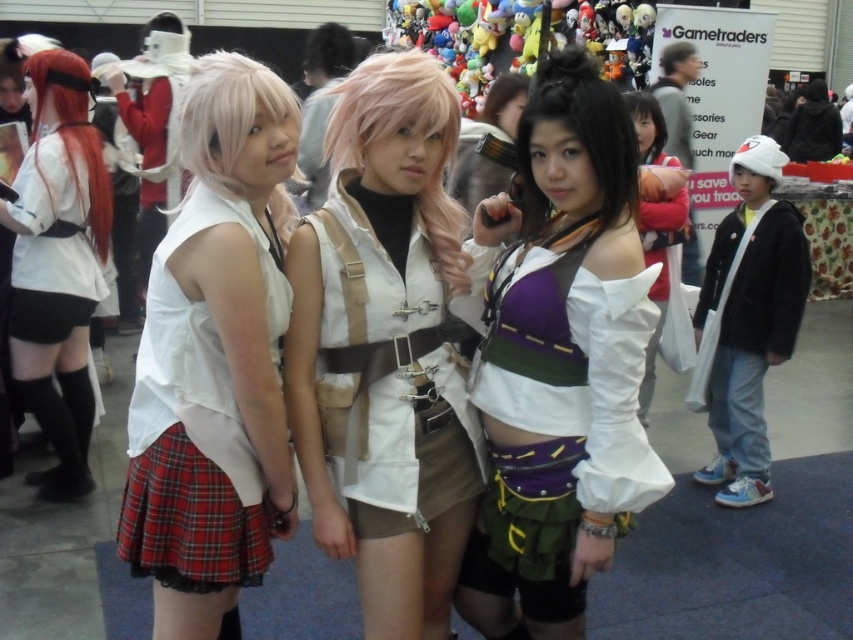
Is matte white shirt at center thinner than pink synthetic wig at center?

In fact, matte white shirt at center might be wider than pink synthetic wig at center.

Does point (363, 460) come behind point (363, 90)?

Yes, it is behind point (363, 90).

Between point (398, 321) and point (384, 138), which one is positioned in front?

Positioned in front is point (384, 138).

In order to click on matte white shirt at center in this screenshot , I will do `click(386, 348)`.

From the picture: Does satin black wig at center come in front of white satin dress at center?

Yes, it is in front of white satin dress at center.

In the scene shown: Which is below, satin black wig at center or white satin dress at center?

white satin dress at center is below.

Is point (602, 109) positioned behind point (656, 346)?

No, it is not.

Locate an element on the screen. This screenshot has width=853, height=640. satin black wig at center is located at coordinates (578, 140).

Is matte white shirt at left in front of black matte wig at upper center?

Yes, matte white shirt at left is closer to the viewer.

Between matte white shirt at left and black matte wig at upper center, which one is positioned higher?

black matte wig at upper center is higher up.

Who is more forward, (x=39, y=250) or (x=303, y=52)?

Point (x=39, y=250) is more forward.

The width and height of the screenshot is (853, 640). I want to click on matte white shirt at left, so click(53, 224).